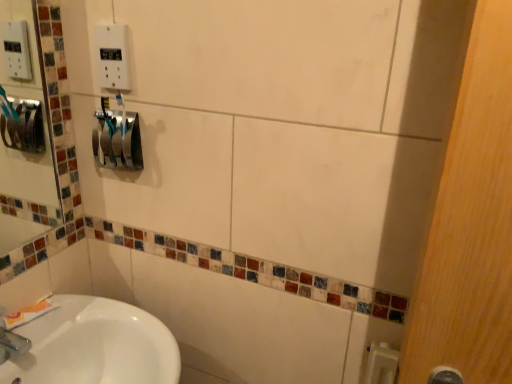
Question: Is blue glossy toothbrush at center-left smaller than white plastic outlet at upper center?

Choices:
 (A) yes
 (B) no

Answer: (A)

Question: Is blue glossy toothbrush at center-left positioned far away from white plastic outlet at upper center?

Choices:
 (A) yes
 (B) no

Answer: (B)

Question: Is the position of blue glossy toothbrush at center-left more distant than that of white plastic outlet at upper center?

Choices:
 (A) no
 (B) yes

Answer: (B)

Question: Is blue glossy toothbrush at center-left positioned before white plastic outlet at upper center?

Choices:
 (A) no
 (B) yes

Answer: (A)

Question: Is blue glossy toothbrush at center-left shorter than white plastic outlet at upper center?

Choices:
 (A) yes
 (B) no

Answer: (B)

Question: From a real-world perspective, is blue glossy toothbrush at center-left positioned over white plastic outlet at upper center based on gravity?

Choices:
 (A) no
 (B) yes

Answer: (A)

Question: Can you confirm if white plastic outlet at upper center is wider than white matte toothpaste at lower left?

Choices:
 (A) no
 (B) yes

Answer: (A)

Question: Does white plastic outlet at upper center have a smaller size compared to white matte toothpaste at lower left?

Choices:
 (A) yes
 (B) no

Answer: (A)

Question: Considering the relative positions of white plastic outlet at upper center and white matte toothpaste at lower left in the image provided, is white plastic outlet at upper center to the right of white matte toothpaste at lower left from the viewer's perspective?

Choices:
 (A) yes
 (B) no

Answer: (A)

Question: From the image's perspective, would you say white plastic outlet at upper center is shown under white matte toothpaste at lower left?

Choices:
 (A) yes
 (B) no

Answer: (B)

Question: Is white plastic outlet at upper center to the left of white matte toothpaste at lower left from the viewer's perspective?

Choices:
 (A) yes
 (B) no

Answer: (B)

Question: Could white matte toothpaste at lower left be considered to be inside white plastic outlet at upper center?

Choices:
 (A) yes
 (B) no

Answer: (B)

Question: Is blue glossy toothbrush at center-left not inside white matte toothpaste at lower left?

Choices:
 (A) no
 (B) yes

Answer: (B)